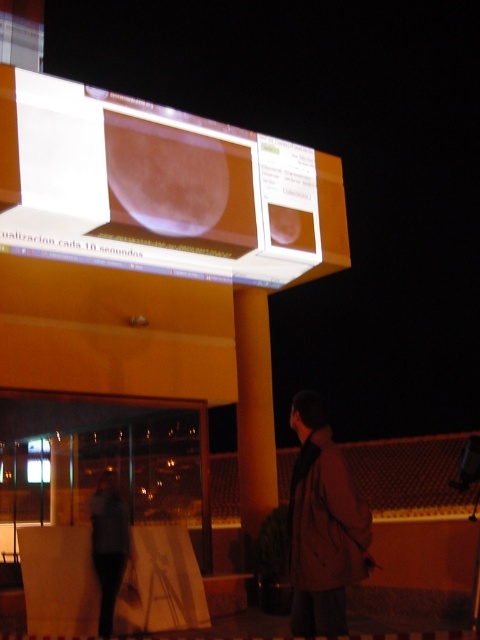
You are standing in the outdoor nighttime scene and want to take a photo of the matte glass screen at upper center without including the dark gray fabric jacket at lower left in the frame. Based on their positions, is this possible?

The matte glass screen at upper center is positioned on the right side of the dark gray fabric jacket at lower left, so if you move to the right of the jacket, you can capture the screen without including the jacket in the frame.

You are a photographer trying to capture a clear shot of the matte glass screen at upper center and the brown leather jacket at lower right. Since you want both objects to be in focus, you need to know which one is taller. Which object is taller?

The matte glass screen at upper center is taller than the brown leather jacket at lower right according to the description.